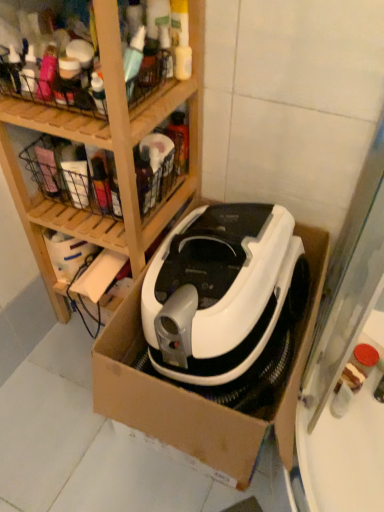
Question: Is metallic wire basket at upper left positioned with its back to white plastic vacuum cleaner at center?

Choices:
 (A) no
 (B) yes

Answer: (A)

Question: From a real-world perspective, is metallic wire basket at upper left below white plastic vacuum cleaner at center?

Choices:
 (A) yes
 (B) no

Answer: (B)

Question: Does metallic wire basket at upper left touch white plastic vacuum cleaner at center?

Choices:
 (A) yes
 (B) no

Answer: (B)

Question: Does metallic wire basket at upper left have a lesser height compared to white plastic vacuum cleaner at center?

Choices:
 (A) yes
 (B) no

Answer: (A)

Question: Is white plastic vacuum cleaner at center a part of metallic wire basket at upper left?

Choices:
 (A) yes
 (B) no

Answer: (B)

Question: Relative to metallic wire basket at upper left, is white plastic vacuum cleaner at center in front or behind?

Choices:
 (A) front
 (B) behind

Answer: (A)

Question: Would you say white plastic vacuum cleaner at center is inside or outside metallic wire basket at upper left?

Choices:
 (A) outside
 (B) inside

Answer: (A)

Question: In the image, is white plastic vacuum cleaner at center on the left side or the right side of metallic wire basket at upper left?

Choices:
 (A) right
 (B) left

Answer: (A)

Question: Is white plastic vacuum cleaner at center bigger or smaller than metallic wire basket at upper left?

Choices:
 (A) big
 (B) small

Answer: (A)

Question: Is wooden at upper left in front of or behind white cardboard box at center in the image?

Choices:
 (A) front
 (B) behind

Answer: (A)

Question: Do you think wooden at upper left is within white cardboard box at center, or outside of it?

Choices:
 (A) inside
 (B) outside

Answer: (B)

Question: Is point (104, 53) positioned closer to the camera than point (137, 361)?

Choices:
 (A) closer
 (B) farther

Answer: (A)

Question: In terms of size, does wooden at upper left appear bigger or smaller than white cardboard box at center?

Choices:
 (A) small
 (B) big

Answer: (B)

Question: In the image, is wooden at upper left on the left side or the right side of white plastic vacuum cleaner at center?

Choices:
 (A) left
 (B) right

Answer: (A)

Question: From their relative heights in the image, would you say wooden at upper left is taller or shorter than white plastic vacuum cleaner at center?

Choices:
 (A) short
 (B) tall

Answer: (B)